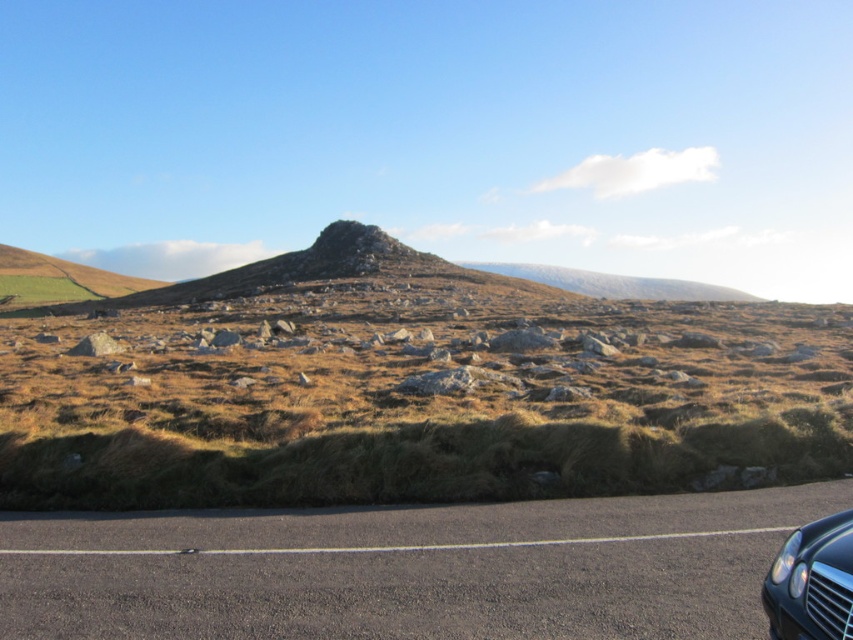
You are driving a car and see the brown grassy hill at center and the shiny black car at lower right. Which object is higher in the image?

The brown grassy hill at center is higher than the shiny black car at lower right in the image.

You are a photographer trying to capture a landscape photo that includes both the brown grassy hill at center and the shiny black car at lower right. Based on their sizes in the image, which object should you focus on first to ensure both are clearly visible in the frame?

The brown grassy hill at center has a larger size compared to the shiny black car at lower right, so you should focus on the brown grassy hill at center first to ensure both are clearly visible in the frame.